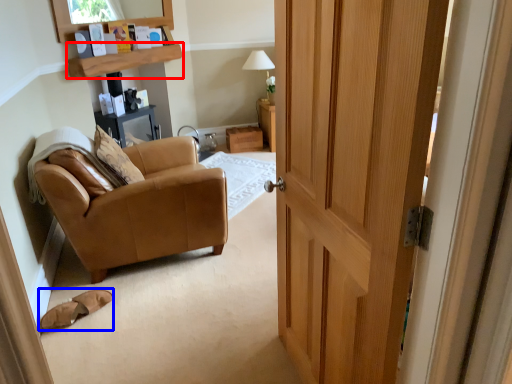
Question: Which of the following is the farthest to the observer, shelf (highlighted by a red box) or footwear (highlighted by a blue box)?

Choices:
 (A) shelf
 (B) footwear

Answer: (A)